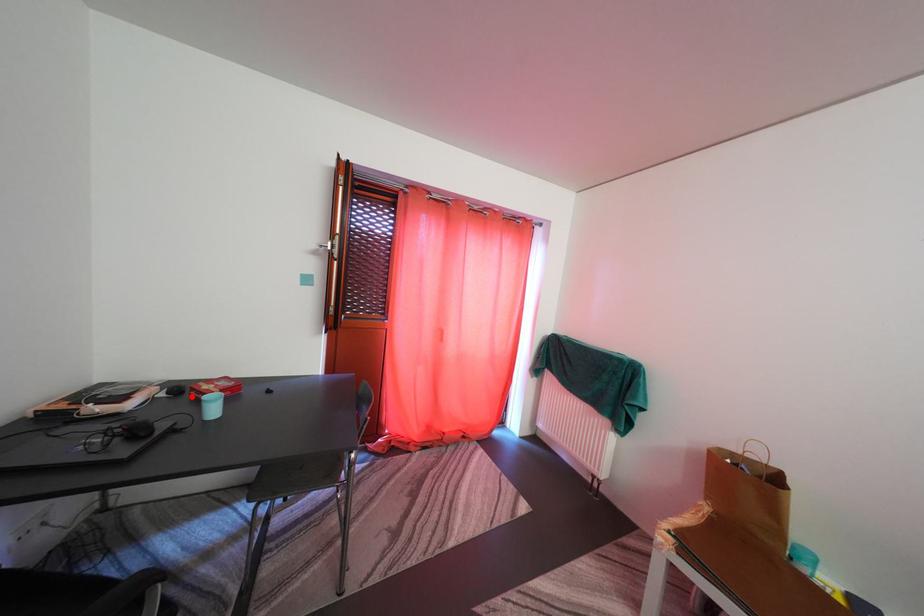
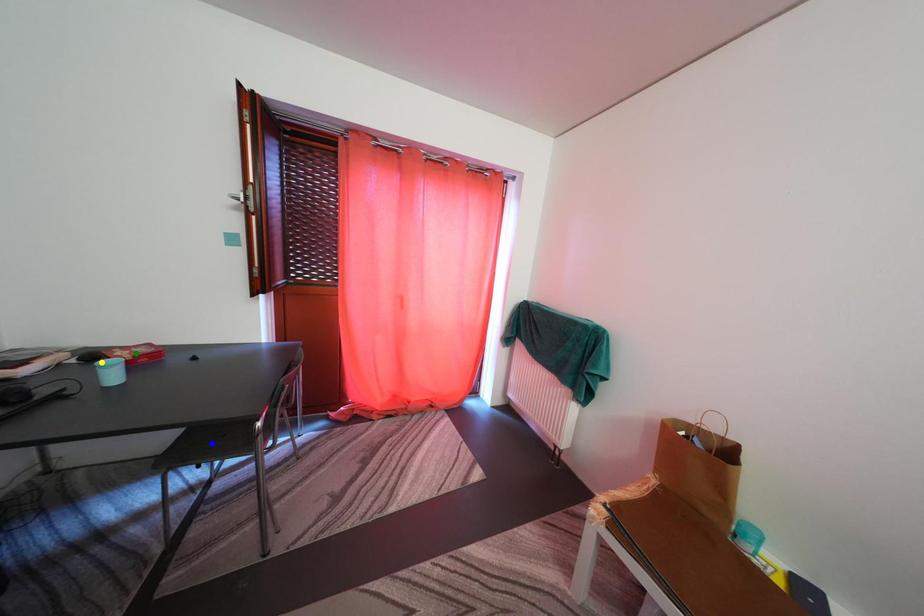
Question: I am providing you with two images of the same scene from different viewpoints. A red point is marked on the first image. You are given multiple points on the second image. Can you choose the point in image 2 that corresponds to the point in image 1?

Choices:
 (A) yellow point
 (B) green point
 (C) blue point

Answer: (A)